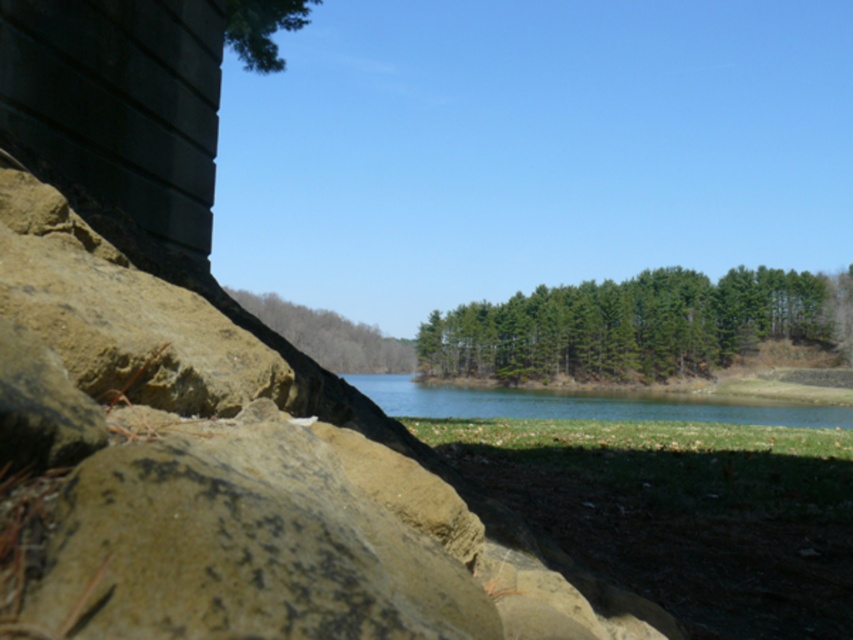
Question: Can you confirm if green leafy trees at center is positioned above green textured tree at upper left?

Choices:
 (A) yes
 (B) no

Answer: (B)

Question: Considering the relative positions of green leafy tree at center and green textured tree at upper left in the image provided, where is green leafy tree at center located with respect to green textured tree at upper left?

Choices:
 (A) right
 (B) left

Answer: (B)

Question: Which of the following is the farthest from the observer?

Choices:
 (A) (300, 10)
 (B) (825, 408)
 (C) (350, 340)

Answer: (C)

Question: Which point is closer to the camera?

Choices:
 (A) green leafy tree at center
 (B) green water at center

Answer: (B)

Question: Does green leafy tree at center appear under green textured tree at upper left?

Choices:
 (A) yes
 (B) no

Answer: (A)

Question: Among these points, which one is farthest from the camera?

Choices:
 (A) (740, 301)
 (B) (231, 8)
 (C) (332, 349)

Answer: (C)